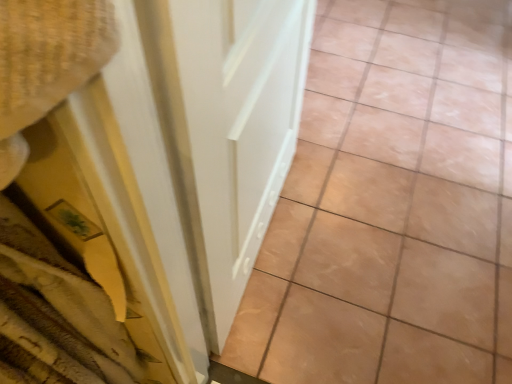
Question: Should I look upward or downward to see white glossy door at center?

Choices:
 (A) down
 (B) up

Answer: (B)

Question: Could you tell me if white glossy door at center is turned towards beige glossy tile at center?

Choices:
 (A) no
 (B) yes

Answer: (A)

Question: Can you see white glossy door at center touching beige glossy tile at center?

Choices:
 (A) no
 (B) yes

Answer: (A)

Question: Does white glossy door at center appear on the right side of beige glossy tile at center?

Choices:
 (A) yes
 (B) no

Answer: (B)

Question: Are white glossy door at center and beige glossy tile at center far apart?

Choices:
 (A) yes
 (B) no

Answer: (B)

Question: From the image's perspective, is white glossy door at center located beneath beige glossy tile at center?

Choices:
 (A) no
 (B) yes

Answer: (B)

Question: Is white glossy door at center positioned before beige glossy tile at center?

Choices:
 (A) no
 (B) yes

Answer: (B)

Question: Is beige glossy tile at center not inside white glossy door at center?

Choices:
 (A) yes
 (B) no

Answer: (A)

Question: Would you say white glossy door at center is part of beige glossy tile at center's contents?

Choices:
 (A) yes
 (B) no

Answer: (B)

Question: Is beige glossy tile at center not near white glossy door at center?

Choices:
 (A) yes
 (B) no

Answer: (B)

Question: From the image's perspective, is beige glossy tile at center over white glossy door at center?

Choices:
 (A) yes
 (B) no

Answer: (A)

Question: Can you confirm if beige glossy tile at center is positioned to the left of white glossy door at center?

Choices:
 (A) yes
 (B) no

Answer: (B)

Question: Does beige glossy tile at center have a lesser height compared to white glossy door at center?

Choices:
 (A) no
 (B) yes

Answer: (B)

Question: From a real-world perspective, is white glossy door at center above or below beige glossy tile at center?

Choices:
 (A) below
 (B) above

Answer: (B)